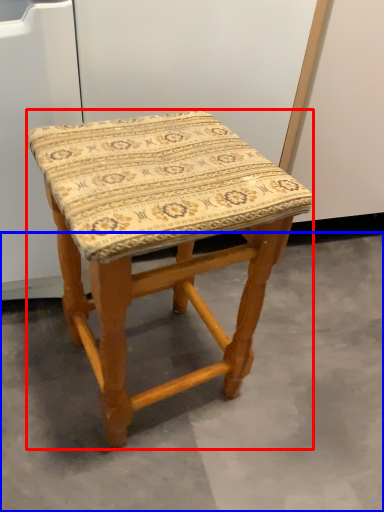
Question: Among these objects, which one is farthest to the camera, stool (highlighted by a red box) or concrete (highlighted by a blue box)?

Choices:
 (A) stool
 (B) concrete

Answer: (B)